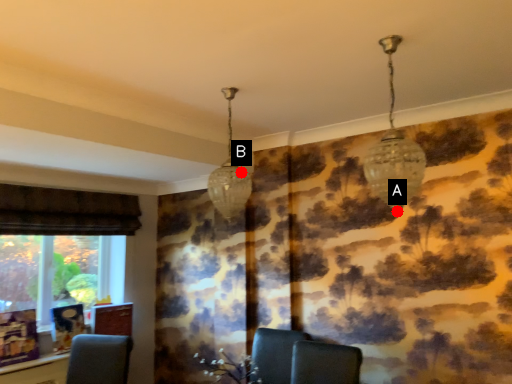
Question: Two points are circled on the image, labeled by A and B beside each circle. Which point is closer to the camera?

Choices:
 (A) A is closer
 (B) B is closer

Answer: (A)